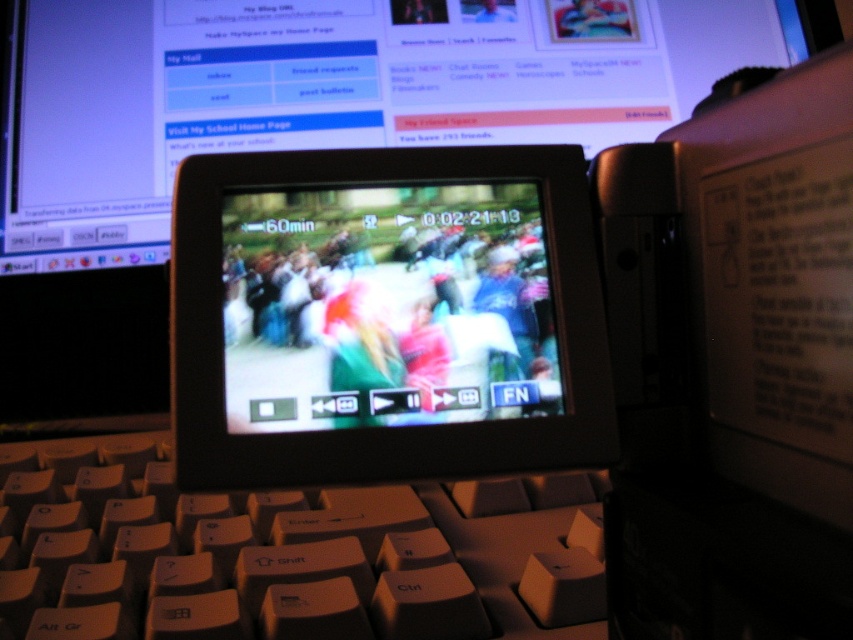
Question: Considering the relative positions of black glossy screen at center and beige plastic keyboard at center in the image provided, where is black glossy screen at center located with respect to beige plastic keyboard at center?

Choices:
 (A) below
 (B) above

Answer: (B)

Question: Can you confirm if black glossy screen at center is wider than beige plastic keyboard at center?

Choices:
 (A) yes
 (B) no

Answer: (B)

Question: Does black glossy screen at center appear over beige plastic keyboard at center?

Choices:
 (A) no
 (B) yes

Answer: (B)

Question: Which point is farther to the camera?

Choices:
 (A) beige plastic keyboard at center
 (B) black glossy screen at center

Answer: (A)

Question: Which of the following is the farthest from the observer?

Choices:
 (A) (445, 157)
 (B) (329, 625)

Answer: (B)

Question: Which object is closer to the camera taking this photo?

Choices:
 (A) black glossy screen at center
 (B) beige plastic keyboard at center

Answer: (A)